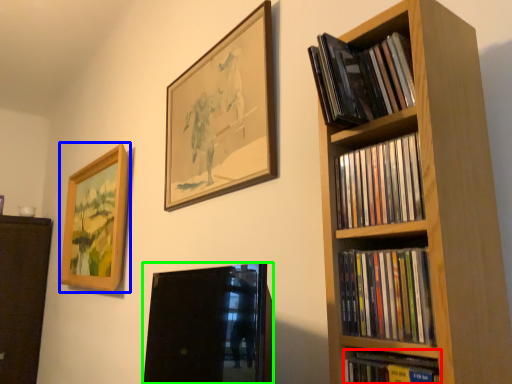
Question: Estimate the real-world distances between objects in this image. Which object is farther from book (highlighted by a red box), picture frame (highlighted by a blue box) or picture frame (highlighted by a green box)?

Choices:
 (A) picture frame
 (B) picture frame

Answer: (B)